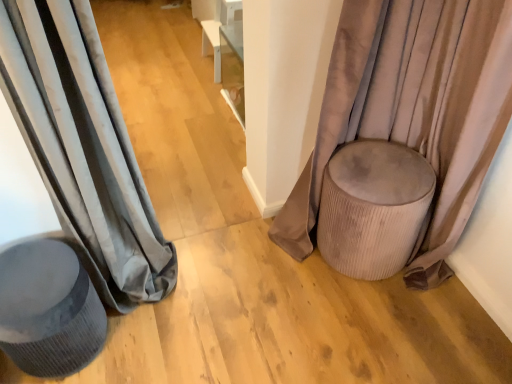
Find the location of a particular element. This screenshot has height=384, width=512. free point in front of velvet beige pouf at right, the 1th curtain positioned from the right is located at coordinates (350, 315).